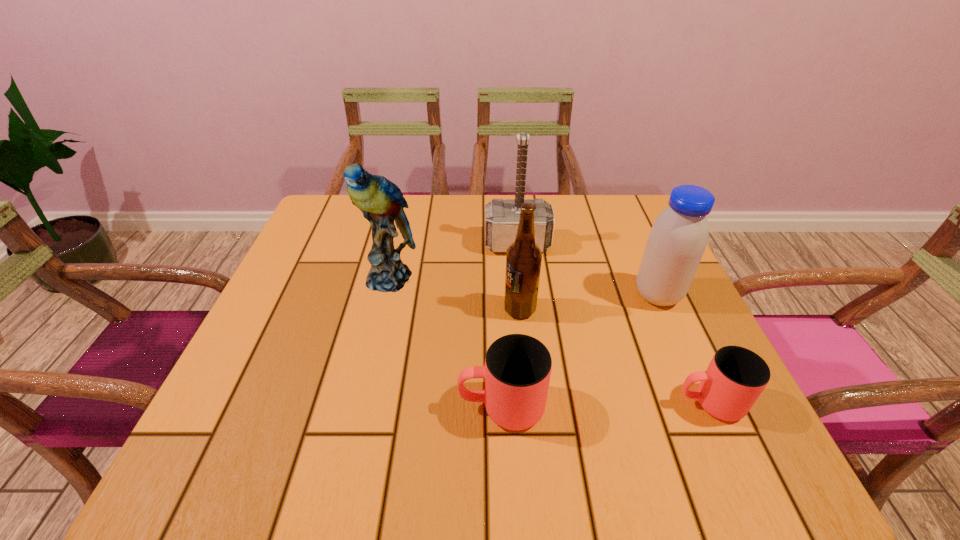
At what (x,y) coordinates should I click in order to perform the action: click on vacant space that's between the soya milk and the farthest object. Please return your answer as a coordinate pair (x, y). The width and height of the screenshot is (960, 540). Looking at the image, I should click on (588, 269).

Where is `unoccupied position between the leftmost object and the fifth tallest object`? The width and height of the screenshot is (960, 540). unoccupied position between the leftmost object and the fifth tallest object is located at coordinates (445, 342).

Where is `free space between the beer bottle and the parrot`? free space between the beer bottle and the parrot is located at coordinates point(454,293).

Where is `free space that is in between the right cup and the leftmost object`? The width and height of the screenshot is (960, 540). free space that is in between the right cup and the leftmost object is located at coordinates (549, 340).

The image size is (960, 540). What are the coordinates of `free space between the soya milk and the beer bottle` in the screenshot? It's located at (588, 302).

I want to click on vacant space that is in between the left cup and the soya milk, so click(580, 351).

The image size is (960, 540). Identify the location of free spot between the farthest object and the shorter cup. click(613, 323).

The width and height of the screenshot is (960, 540). Find the location of `vacant space that's between the shorter cup and the soya milk`. vacant space that's between the shorter cup and the soya milk is located at coordinates (684, 349).

Find the location of `object that is the fifth closest to the leftmost object`. object that is the fifth closest to the leftmost object is located at coordinates (736, 376).

Select which object is the third closest to the parrot. Please provide its 2D coordinates. Your answer should be formatted as a tuple, i.e. [(x, y)], where the tuple contains the x and y coordinates of a point satisfying the conditions above.

[(517, 370)]